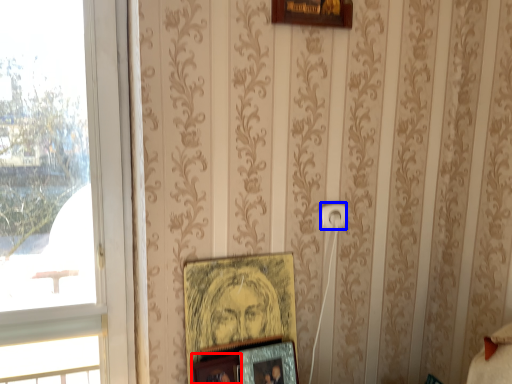
Question: Which object is closer to the camera taking this photo, picture frame (highlighted by a red box) or electric outlet (highlighted by a blue box)?

Choices:
 (A) picture frame
 (B) electric outlet

Answer: (A)